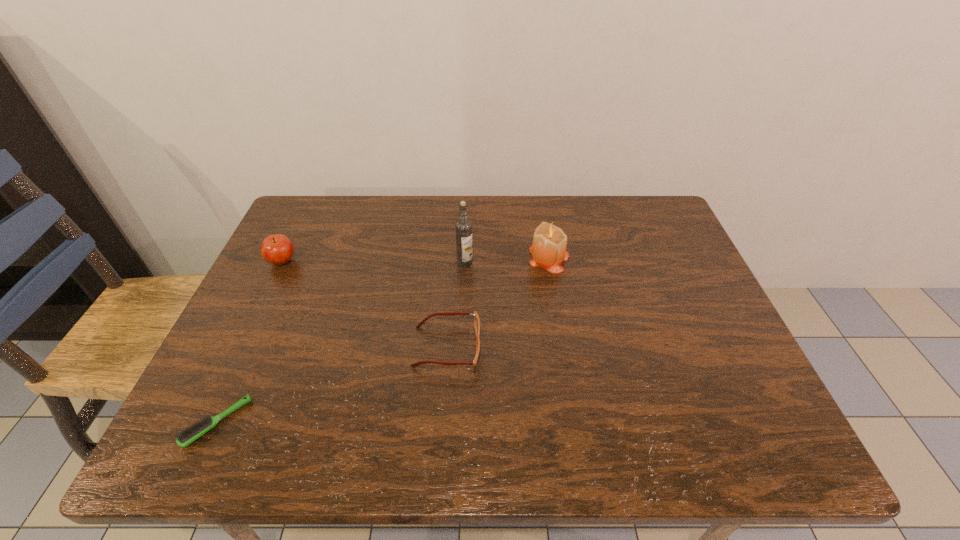
In the image, there is a desktop. What are the coordinates of `vacant space at the right edge` in the screenshot? It's located at (691, 313).

Find the location of a particular element. Image resolution: width=960 pixels, height=540 pixels. vacant space at the far left corner of the desktop is located at coordinates (322, 203).

You are a GUI agent. You are given a task and a screenshot of the screen. Output one action in this format:
    pyautogui.click(x=<x>, y=<y>)
    Task: Click on the unoccupied position between the third shortest object and the vodka
    
    Given the screenshot: What is the action you would take?
    pyautogui.click(x=373, y=262)

Where is `vacant point located between the candle and the vodka`? vacant point located between the candle and the vodka is located at coordinates (507, 260).

Find the location of a particular element. The image size is (960, 540). empty space between the vodka and the apple is located at coordinates (373, 262).

Find the location of a particular element. vacant space that's between the second tallest object and the apple is located at coordinates (416, 260).

Identify the location of free space between the second shortest object and the apple. (365, 304).

Identify the location of vacant space that is in between the tallest object and the candle. This screenshot has width=960, height=540. (507, 260).

Identify the location of unoccupied position between the third shortest object and the hairbrush. (250, 342).

Locate an element on the screen. The height and width of the screenshot is (540, 960). free spot between the fourth tallest object and the fourth shortest object is located at coordinates (498, 302).